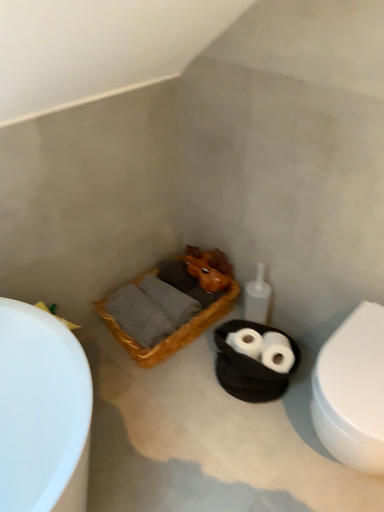
I want to click on free space to the left of black woven basket at center, so click(193, 394).